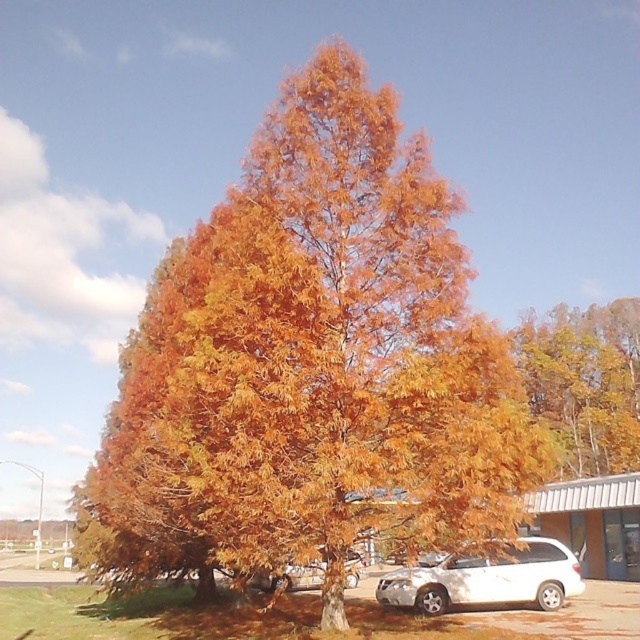
You are standing in the parking lot and see the orange matte tree at upper right and the satin silver car at center. Which object is closer to you?

The orange matte tree at upper right is closer to you because the satin silver car at center is behind it.

From the picture: You are standing in a park and see the orange leafy tree at center and the white matte van at lower right. Which object takes up more space in the image?

The orange leafy tree at center takes up more space in the image because it has a larger size compared to the white matte van at lower right.